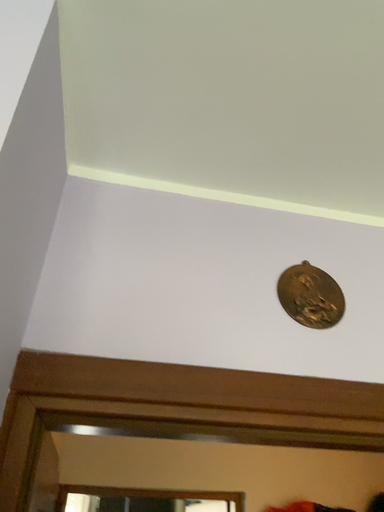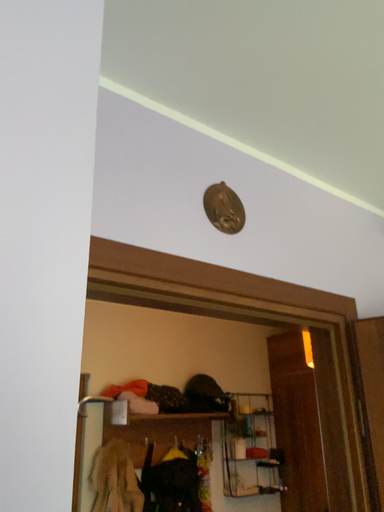
Question: Which way did the camera rotate in the video?

Choices:
 (A) rotated left
 (B) rotated right

Answer: (B)